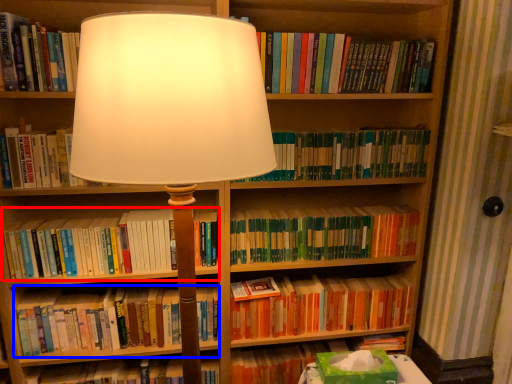
Question: Which of the following is the closest to the observer, book (highlighted by a red box) or book (highlighted by a blue box)?

Choices:
 (A) book
 (B) book

Answer: (A)